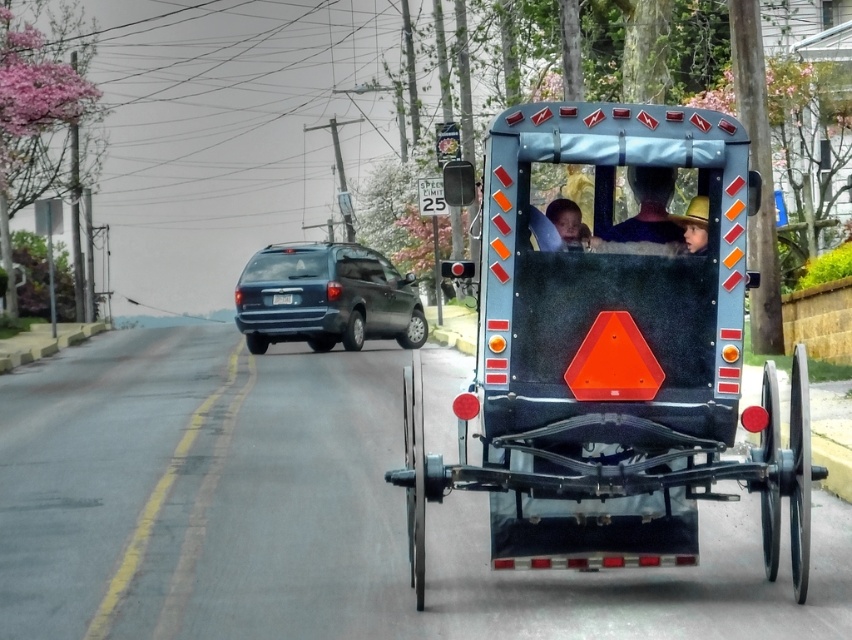
Question: Which object is farther from the camera taking this photo?

Choices:
 (A) metallic blue rickshaw at center
 (B) yellow straw hat at center
 (C) matte black face at center
 (D) glossy metallic suv at center

Answer: (D)

Question: Is the position of metallic blue rickshaw at center more distant than that of glossy metallic suv at center?

Choices:
 (A) no
 (B) yes

Answer: (A)

Question: Which point is closer to the camera?

Choices:
 (A) matte black face at center
 (B) blue fabric hat at center
 (C) glossy metallic suv at center

Answer: (A)

Question: Is matte black face at center below yellow straw hat at center?

Choices:
 (A) yes
 (B) no

Answer: (A)

Question: Based on their relative distances, which object is nearer to the glossy metallic suv at center?

Choices:
 (A) metallic blue rickshaw at center
 (B) yellow straw hat at center

Answer: (A)

Question: Is metallic blue rickshaw at center to the left of yellow straw hat at center from the viewer's perspective?

Choices:
 (A) yes
 (B) no

Answer: (A)